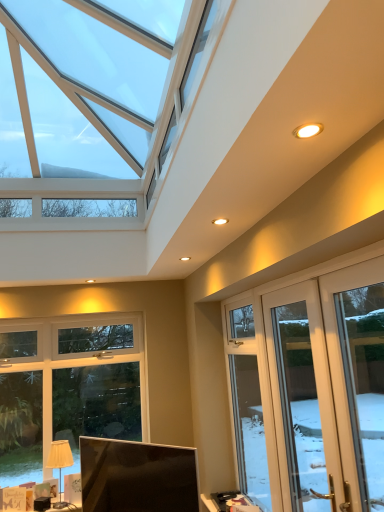
Question: Based on their sizes in the image, would you say clear glass door at center, arranged as the 1th window when viewed from the back, is bigger or smaller than matte white screen door at lower right, positioned as the first screen door in front-to-back order?

Choices:
 (A) small
 (B) big

Answer: (A)

Question: From a real-world perspective, is clear glass door at center, positioned as the second window in front-to-back order, physically located above or below matte white screen door at lower right, acting as the second screen door starting from the back?

Choices:
 (A) below
 (B) above

Answer: (A)

Question: Which is nearer to the matte black monitor at lower center?

Choices:
 (A) matte white screen door at lower right, positioned as the first screen door in front-to-back order
 (B) clear glass door at right, acting as the 2th window starting from the left
 (C) beige fabric lampshade at lower left
 (D) clear glass door at center, arranged as the 1th window when viewed from the back
 (E) white glossy door at right, the second screen door from the front

Answer: (C)

Question: Which of these objects is positioned closest to the white glossy door at right, the second screen door from the front?

Choices:
 (A) beige fabric lampshade at lower left
 (B) matte white screen door at lower right, positioned as the first screen door in front-to-back order
 (C) clear glass door at right, acting as the 2th window starting from the left
 (D) matte black monitor at lower center
 (E) clear glass door at center, positioned as the second window in front-to-back order

Answer: (B)